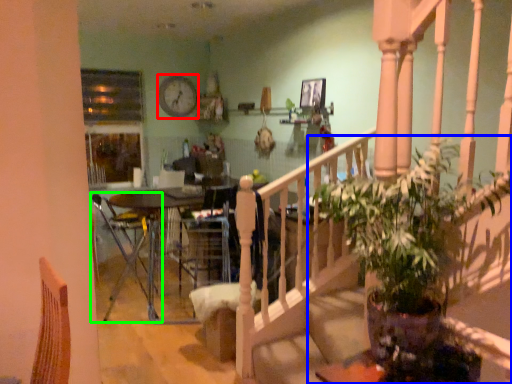
Question: Based on their relative distances, which object is farther from clock (highlighted by a red box)? Choose from houseplant (highlighted by a blue box) and chair (highlighted by a green box).

Choices:
 (A) houseplant
 (B) chair

Answer: (A)